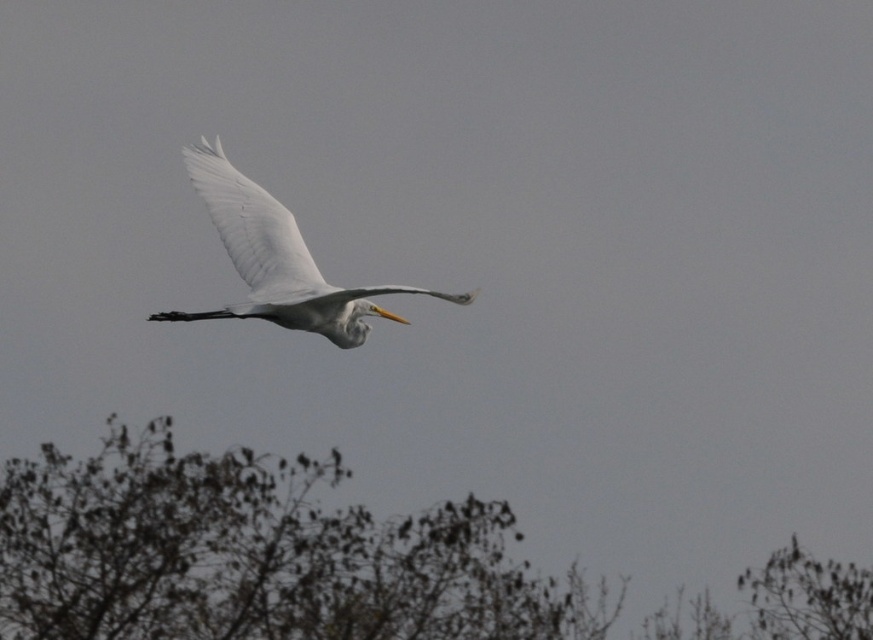
Is white feathered bird at center above white feathered wing at center?

No, white feathered bird at center is not above white feathered wing at center.

Where is `white feathered bird at center`? white feathered bird at center is located at coordinates (278, 259).

Does brown textured tree at lower center come behind white feathered wing at center?

Yes, it is.

Measure the distance from brown textured tree at lower center to white feathered wing at center.

brown textured tree at lower center is 18.47 meters from white feathered wing at center.

Locate an element on the screen. This screenshot has height=640, width=873. brown textured tree at lower center is located at coordinates (258, 554).

Can you confirm if brown textured tree at lower center is bigger than white feathered bird at center?

Yes.

Is point (432, 531) positioned before point (324, 308)?

No.

Find the location of a particular element. The height and width of the screenshot is (640, 873). brown textured tree at lower center is located at coordinates (258, 554).